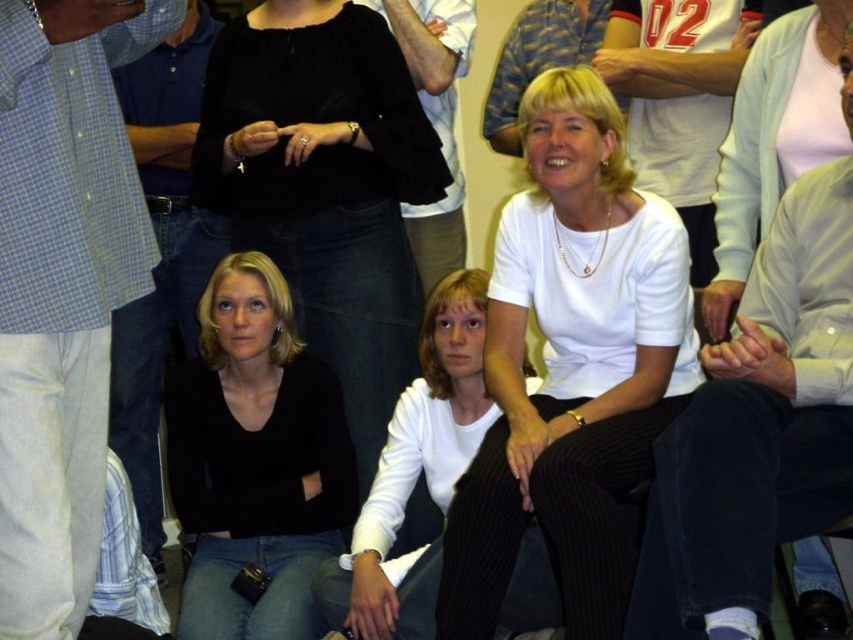
Is point (293, 387) behind point (796, 68)?

Yes, point (293, 387) is farther from viewer.

Describe the element at coordinates (254, 460) in the screenshot. The width and height of the screenshot is (853, 640). I see `black matte shirt at lower left` at that location.

At what (x,y) coordinates should I click in order to perform the action: click on black matte shirt at lower left. Please return your answer as a coordinate pair (x, y). Looking at the image, I should click on coord(254,460).

Who is lower down, white matte shirt at center or light pink fabric at upper right?

Positioned lower is white matte shirt at center.

Between white matte shirt at center and light pink fabric at upper right, which one appears on the right side from the viewer's perspective?

light pink fabric at upper right is more to the right.

The width and height of the screenshot is (853, 640). Identify the location of white matte shirt at center. click(572, 368).

Locate an element on the screen. The width and height of the screenshot is (853, 640). white matte shirt at center is located at coordinates (572, 368).

Does light blue checkered shirt at left appear on the left side of black matte shirt at center?

Correct, you'll find light blue checkered shirt at left to the left of black matte shirt at center.

Does point (13, 403) come behind point (318, 304)?

No.

The image size is (853, 640). In order to click on light blue checkered shirt at left in this screenshot , I will do `click(62, 289)`.